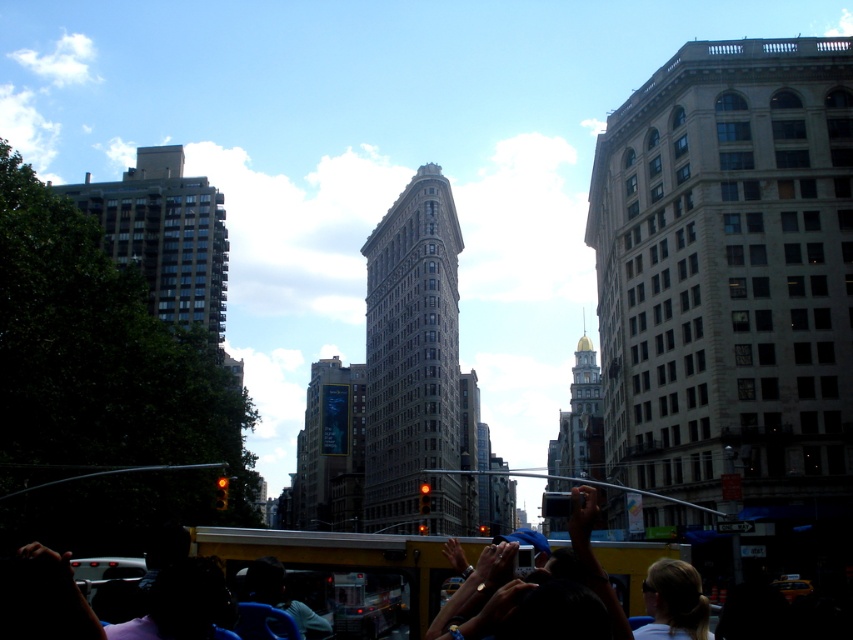
You are a tourist standing on the sidewalk and want to take a photo of the gray stone building at center and the matte yellow bus at center. Which object should you focus on first if you want to capture both in the same frame without moving your camera?

You should focus on the gray stone building at center first because it is larger than the matte yellow bus at center, so it will occupy more space in the frame and ensure both are visible.

You are standing on the sidewalk in front of the Flatiron Building and want to take a photo that includes both the Flatiron Building and the dark brown concrete building at left. Given that your camera has a 60 degree field of view, will you be able to capture both buildings in a single frame?

The dark brown concrete building at left is 131.34 meters away from the viewer. Considering the camera has a 60 degree field of view, it is possible to capture both buildings in a single frame as the distance allows the angle to encompass both structures.